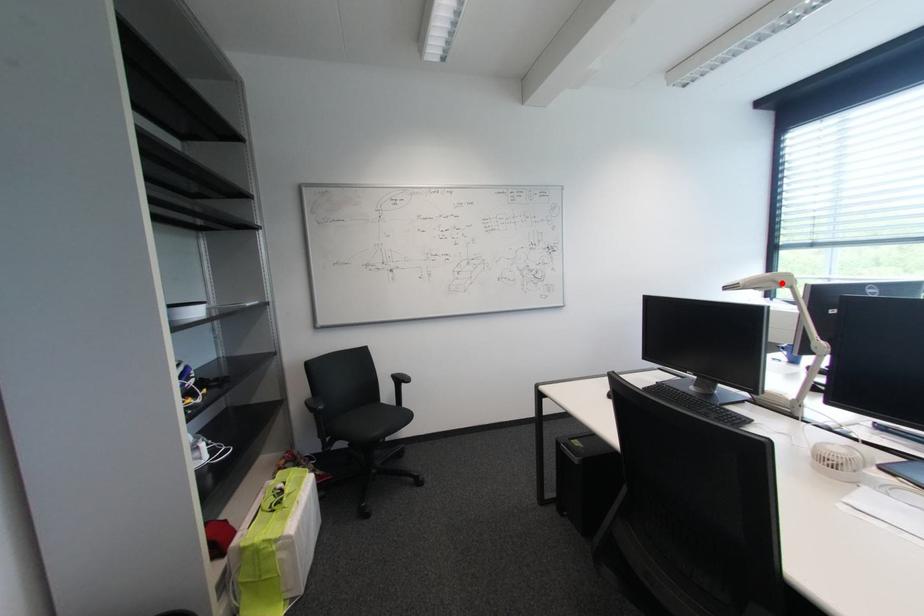
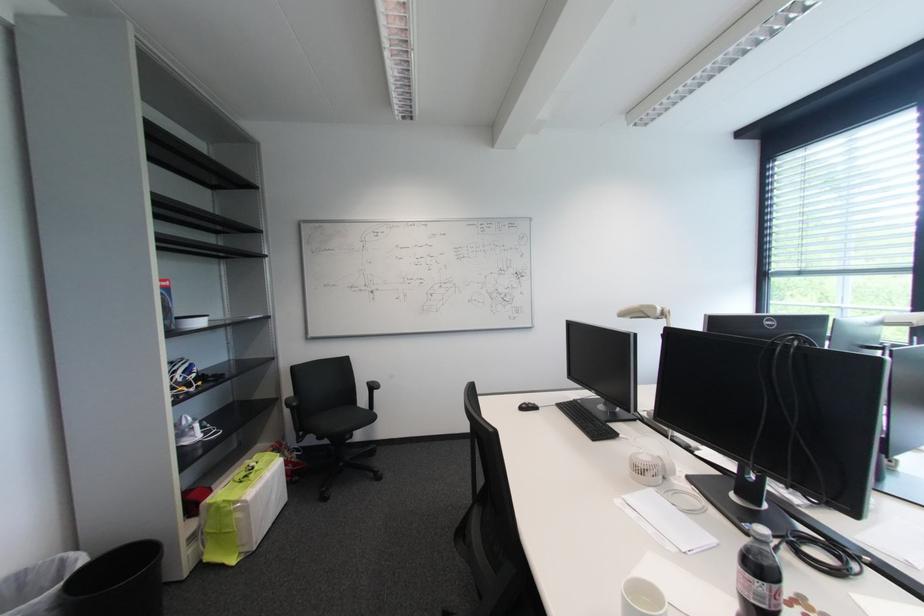
Where in the second image is the point corresponding to the highlighted location from the first image?

(649, 314)